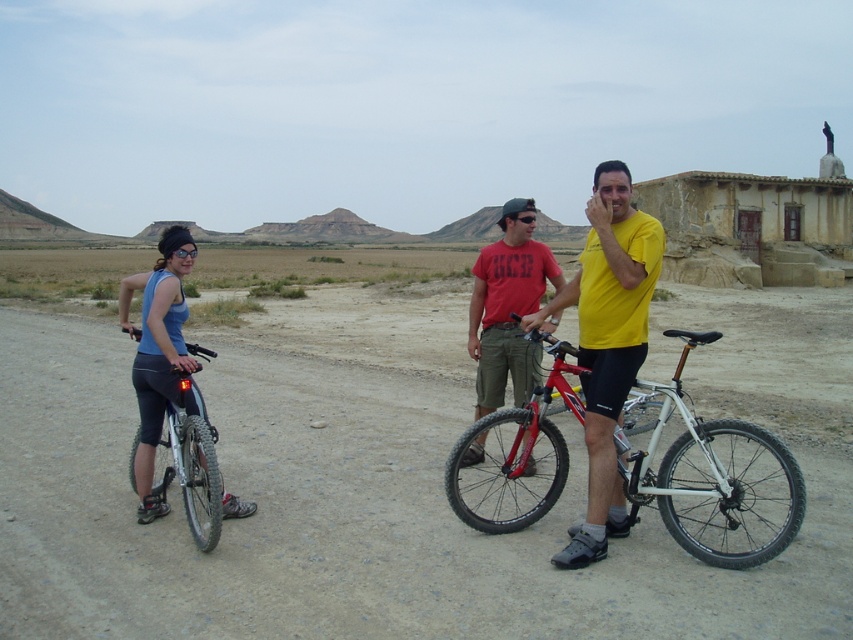
You are a photographer standing on the dirt road. You want to take a photo of the white matte bicycle at center and the yellow matte shirt at center. Which object should you focus on first if you want to capture both clearly in the same frame?

The white matte bicycle at center is positioned under the yellow matte shirt at center, so you should focus on the yellow matte shirt at center first to ensure both are in focus since it is closer to the camera.

In the scene shown: You are standing at the point marked by the coordinates point (508, 307). Which object from the scene are you currently standing on?

The point (508, 307) is on the red matte shirt at center.